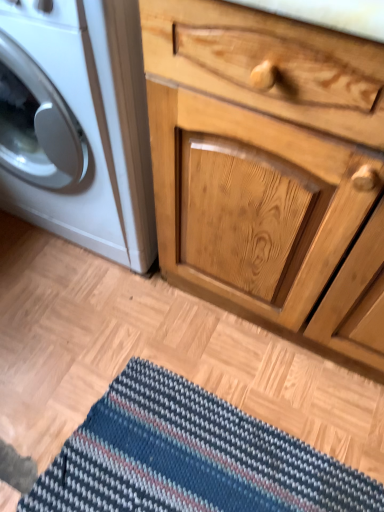
Question: Is striped fabric doormat at lower center bigger than natural wood cabinet at center?

Choices:
 (A) no
 (B) yes

Answer: (A)

Question: Is striped fabric doormat at lower center oriented towards natural wood cabinet at center?

Choices:
 (A) no
 (B) yes

Answer: (A)

Question: Is striped fabric doormat at lower center behind natural wood cabinet at center?

Choices:
 (A) no
 (B) yes

Answer: (B)

Question: Considering the relative sizes of striped fabric doormat at lower center and natural wood cabinet at center in the image provided, is striped fabric doormat at lower center wider than natural wood cabinet at center?

Choices:
 (A) no
 (B) yes

Answer: (A)

Question: Is striped fabric doormat at lower center outside of natural wood cabinet at center?

Choices:
 (A) yes
 (B) no

Answer: (A)

Question: From their relative heights in the image, would you say white glossy washing machine at left is taller or shorter than natural wood cabinet at center?

Choices:
 (A) tall
 (B) short

Answer: (B)

Question: Relative to natural wood cabinet at center, is white glossy washing machine at left in front or behind?

Choices:
 (A) front
 (B) behind

Answer: (B)

Question: In terms of width, does white glossy washing machine at left look wider or thinner when compared to natural wood cabinet at center?

Choices:
 (A) thin
 (B) wide

Answer: (B)

Question: In the image, is white glossy washing machine at left on the left side or the right side of natural wood cabinet at center?

Choices:
 (A) right
 (B) left

Answer: (B)

Question: From their relative heights in the image, would you say natural wood cabinet at center is taller or shorter than striped fabric doormat at lower center?

Choices:
 (A) short
 (B) tall

Answer: (B)

Question: From a real-world perspective, is natural wood cabinet at center above or below striped fabric doormat at lower center?

Choices:
 (A) below
 (B) above

Answer: (B)

Question: Do you think natural wood cabinet at center is within striped fabric doormat at lower center, or outside of it?

Choices:
 (A) inside
 (B) outside

Answer: (B)

Question: Considering the positions of point (284, 327) and point (107, 480), is point (284, 327) closer or farther from the camera than point (107, 480)?

Choices:
 (A) farther
 (B) closer

Answer: (A)

Question: From a real-world perspective, is striped fabric doormat at lower center above or below natural wood cabinet at center?

Choices:
 (A) below
 (B) above

Answer: (A)

Question: Is striped fabric doormat at lower center taller or shorter than natural wood cabinet at center?

Choices:
 (A) short
 (B) tall

Answer: (A)